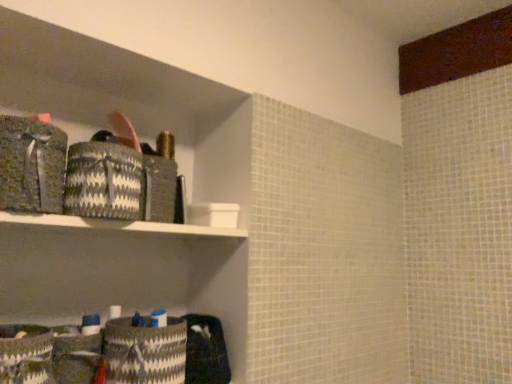
Question: Is white and black woven basket at lower left, which appears as the 3th material when viewed from the top, surrounded by black and white woven basket at upper left, which appears as the 2th material when viewed from the top?

Choices:
 (A) yes
 (B) no

Answer: (B)

Question: Is black and white woven basket at upper left, which appears as the 2th material when viewed from the top, thinner than white and black woven basket at lower left, which appears as the 3th material when viewed from the top?

Choices:
 (A) no
 (B) yes

Answer: (B)

Question: Is black and white woven basket at upper left, which appears as the 2th material when ordered from the bottom, to the left of white and black woven basket at lower left, which appears as the 3th material when viewed from the top, from the viewer's perspective?

Choices:
 (A) yes
 (B) no

Answer: (A)

Question: From a real-world perspective, is black and white woven basket at upper left, which appears as the 2th material when ordered from the bottom, positioned over white and black woven basket at lower left, which ranks as the first material in bottom-to-top order, based on gravity?

Choices:
 (A) no
 (B) yes

Answer: (B)

Question: Is black and white woven basket at upper left, which appears as the 2th material when viewed from the top, taller than white and black woven basket at lower left, which ranks as the first material in bottom-to-top order?

Choices:
 (A) no
 (B) yes

Answer: (A)

Question: Does point (22, 198) appear closer or farther from the camera than point (122, 170)?

Choices:
 (A) closer
 (B) farther

Answer: (A)

Question: From the image's perspective, is textured gray fabric at left, which ranks as the third material in bottom-to-top order, above or below black and white woven basket at upper left, which appears as the 2th material when ordered from the bottom?

Choices:
 (A) below
 (B) above

Answer: (B)

Question: In terms of height, does textured gray fabric at left, which ranks as the third material in bottom-to-top order, look taller or shorter compared to black and white woven basket at upper left, which appears as the 2th material when viewed from the top?

Choices:
 (A) tall
 (B) short

Answer: (A)

Question: Visually, is textured gray fabric at left, which ranks as the third material in bottom-to-top order, positioned to the left or to the right of black and white woven basket at upper left, which appears as the 2th material when viewed from the top?

Choices:
 (A) left
 (B) right

Answer: (A)

Question: Is black and white woven basket at upper left, which appears as the 2th material when ordered from the bottom, bigger or smaller than white and black woven basket at lower left, which ranks as the first material in bottom-to-top order?

Choices:
 (A) small
 (B) big

Answer: (A)

Question: From a real-world perspective, is black and white woven basket at upper left, which appears as the 2th material when viewed from the top, physically located above or below white and black woven basket at lower left, which appears as the 3th material when viewed from the top?

Choices:
 (A) below
 (B) above

Answer: (B)

Question: From the image's perspective, relative to white and black woven basket at lower left, which appears as the 3th material when viewed from the top, is black and white woven basket at upper left, which appears as the 2th material when viewed from the top, above or below?

Choices:
 (A) above
 (B) below

Answer: (A)

Question: Choose the correct answer: Is black and white woven basket at upper left, which appears as the 2th material when ordered from the bottom, inside white and black woven basket at lower left, which ranks as the first material in bottom-to-top order, or outside it?

Choices:
 (A) inside
 (B) outside

Answer: (B)

Question: Is white and black woven basket at lower left, which ranks as the first material in bottom-to-top order, to the left or to the right of black and white woven basket at upper left, which appears as the 2th material when viewed from the top, in the image?

Choices:
 (A) right
 (B) left

Answer: (A)

Question: Would you say white and black woven basket at lower left, which ranks as the first material in bottom-to-top order, is inside or outside black and white woven basket at upper left, which appears as the 2th material when ordered from the bottom?

Choices:
 (A) outside
 (B) inside

Answer: (A)